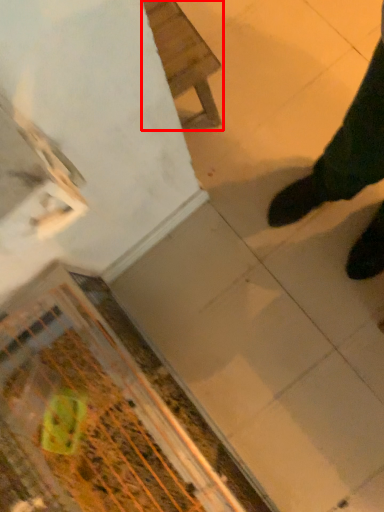
Question: Considering the relative positions of furniture (annotated by the red box) and debris in the image provided, where is furniture (annotated by the red box) located with respect to the staircase?

Choices:
 (A) left
 (B) right

Answer: (B)